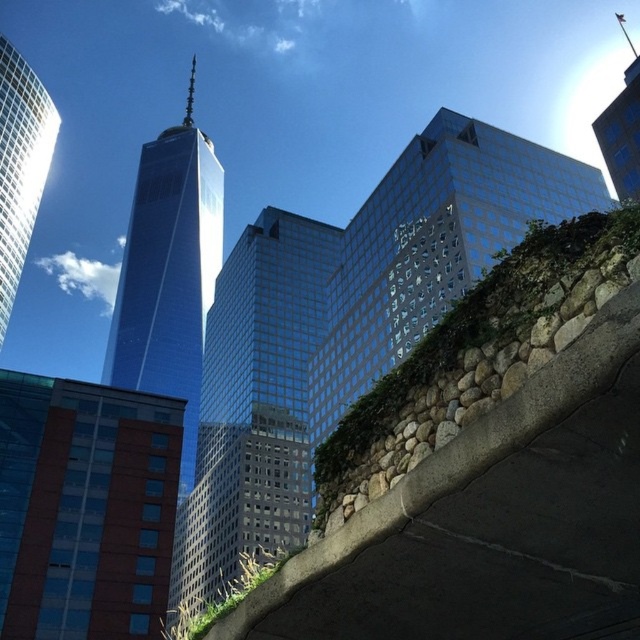
Between glassy reflective skyscraper at center and shiny glass skyscraper at center, which one has more height?

With more height is shiny glass skyscraper at center.

Which is more to the left, glassy reflective skyscraper at center or shiny glass skyscraper at center?

shiny glass skyscraper at center is more to the left.

Locate an element on the screen. glassy reflective skyscraper at center is located at coordinates (433, 246).

Find the location of a particular element. glassy reflective skyscraper at center is located at coordinates (433, 246).

Does glassy blue skyscraper at center have a smaller size compared to shiny glass skyscraper at upper left?

Actually, glassy blue skyscraper at center might be larger than shiny glass skyscraper at upper left.

Is point (301, 396) more distant than point (22, 129)?

That is True.

Does point (250, 541) come closer to viewer compared to point (4, 228)?

Yes, it is.

At what (x,y) coordinates should I click in order to perform the action: click on glassy blue skyscraper at center. Please return your answer as a coordinate pair (x, y). Looking at the image, I should click on (253, 406).

Is point (460, 128) farther from viewer compared to point (44, 132)?

No, it is in front of (44, 132).

Where is `glassy reflective skyscraper at center`? This screenshot has width=640, height=640. glassy reflective skyscraper at center is located at coordinates [433, 246].

Where is `glassy reflective skyscraper at center`? glassy reflective skyscraper at center is located at coordinates (433, 246).